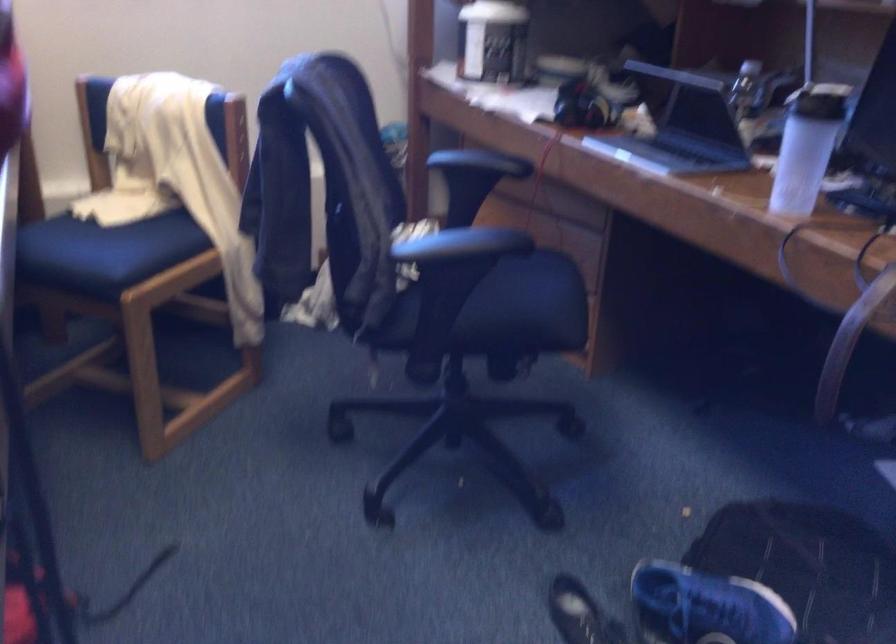
Where would you sit the blue chair sitting surface? Please return your answer as a coordinate pair (x, y).

(123, 200)